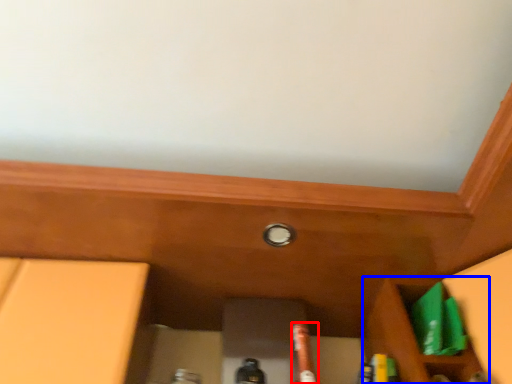
Question: Which of the following is the farthest to the observer, beer bottle (highlighted by a red box) or cabinetry (highlighted by a blue box)?

Choices:
 (A) beer bottle
 (B) cabinetry

Answer: (B)